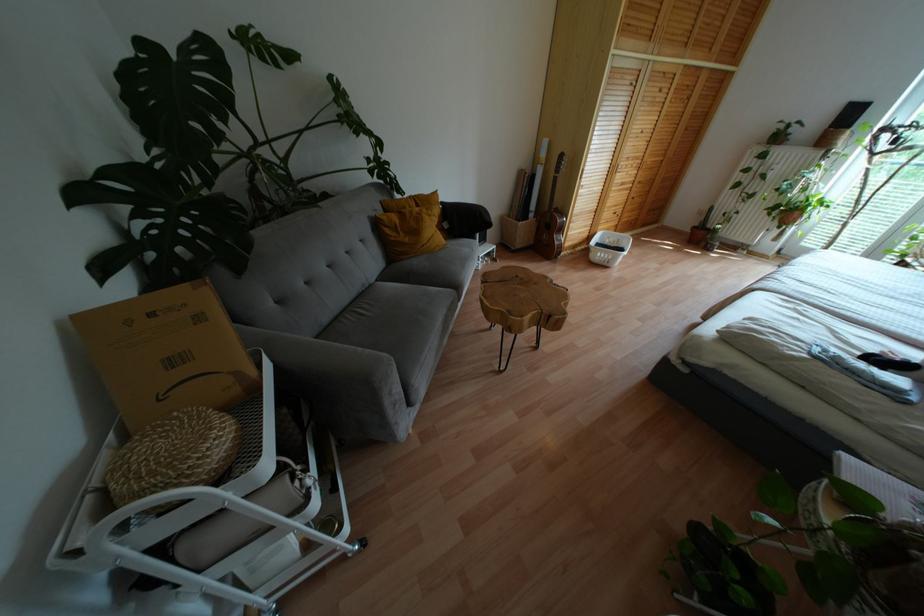
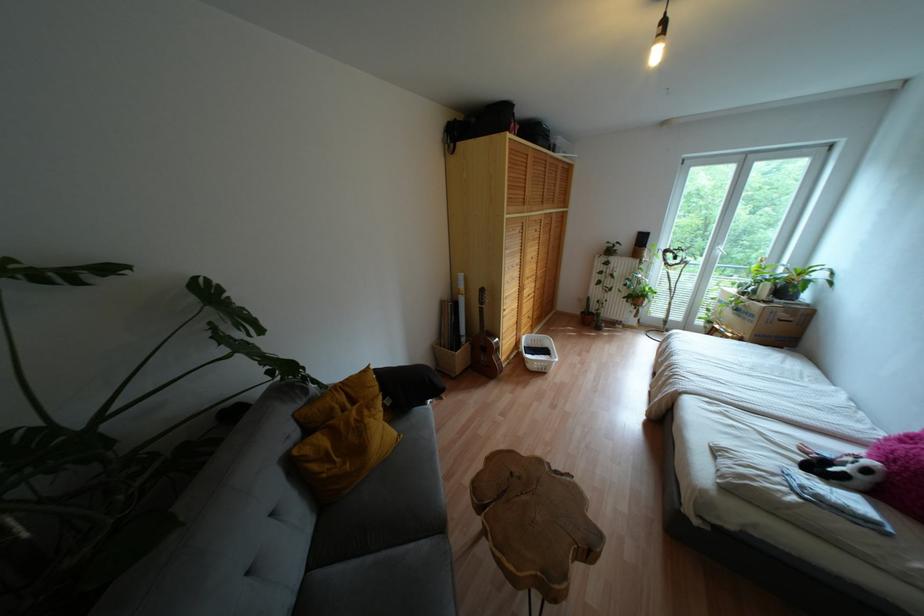
Locate, in the second image, the point that corresponds to the point at 418,201 in the first image.

(348, 391)